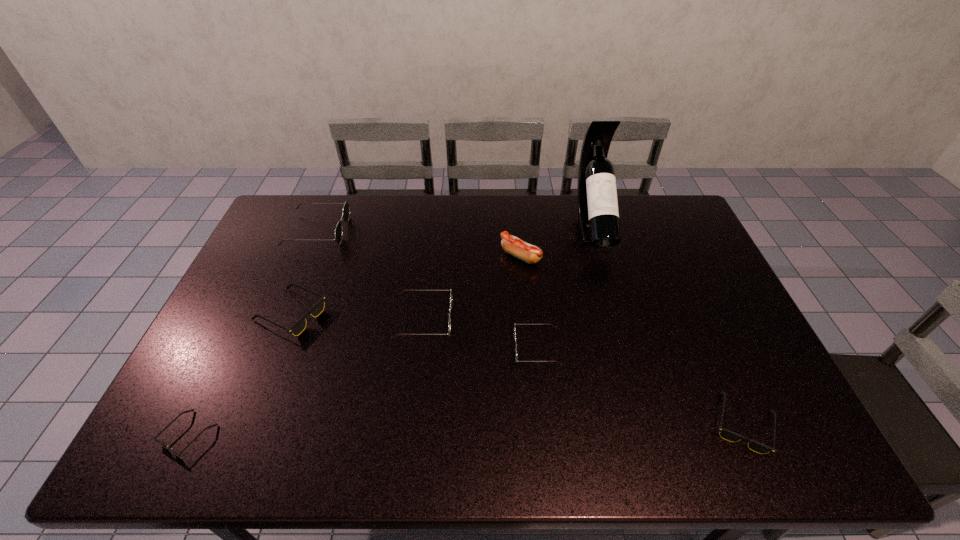
Locate an element on the screen. The width and height of the screenshot is (960, 540). vacant position located 0.070m on the front-facing side of the second sunglasses from right to left is located at coordinates click(490, 348).

Identify the location of vacant space located on the front-facing side of the second sunglasses from right to left. The width and height of the screenshot is (960, 540). point(376,348).

Locate an element on the screen. The height and width of the screenshot is (540, 960). wine bottle situated at the far edge is located at coordinates point(598,216).

Locate an element on the screen. This screenshot has height=540, width=960. sunglasses that is at the far edge is located at coordinates (346, 209).

You are a GUI agent. You are given a task and a screenshot of the screen. Output one action in this format:
    pyautogui.click(x=<x>, y=<y>)
    Task: Click on the object situated at the right edge
    This screenshot has width=960, height=540.
    Given the screenshot: What is the action you would take?
    pyautogui.click(x=726, y=434)

You are a GUI agent. You are given a task and a screenshot of the screen. Output one action in this format:
    pyautogui.click(x=<x>, y=<y>)
    Task: Click on the object that is positioned at the far left corner
    The image size is (960, 540).
    Given the screenshot: What is the action you would take?
    click(346, 209)

This screenshot has width=960, height=540. I want to click on object located at the near left corner, so click(154, 438).

Where is `object that is at the near right corner`? This screenshot has width=960, height=540. object that is at the near right corner is located at coordinates (726, 434).

Find the location of a particular element. This screenshot has height=540, width=960. free spot at the far edge of the desktop is located at coordinates (567, 198).

Where is `vacant space at the near edge`? Image resolution: width=960 pixels, height=540 pixels. vacant space at the near edge is located at coordinates (307, 455).